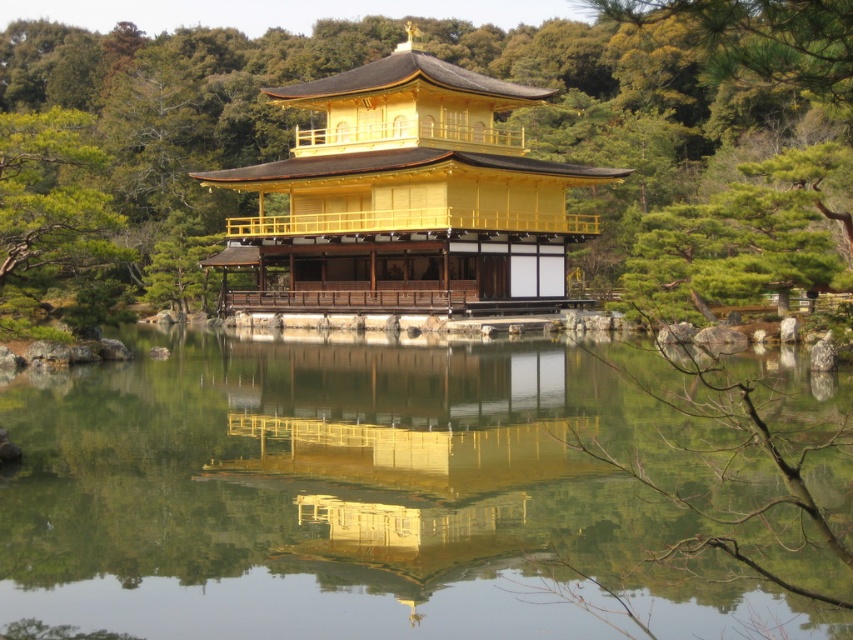
Consider the image. You are a photographer planning to capture the Golden Pavilion and its reflection in the water. You are standing at the edge of the transparent glass water at center and want to walk to the green leafy tree at center to adjust your shot. Given that your camera bag is 1.2 meters in length, will you be able to carry it comfortably while moving between these two points?

The distance between the transparent glass water at center and the green leafy tree at center is 32.39 meters. Since the camera bag is only 1.2 meters in length, the distance between the two points is much larger than the camera bag length. Therefore, you can comfortably carry the camera bag while moving between these two points.

You are a visitor at Kinkaku temple and want to take a photo that includes both the green leafy tree at center and the golden polished wood pagoda at center. Which object should you position closer to the camera to ensure both fit in the frame?

The golden polished wood pagoda at center is smaller in size than the green leafy tree at center, so positioning the golden polished wood pagoda at center closer to the camera will help both fit within the frame.

You are a visitor at Kinkaku temple and want to take a photo of the transparent glass water at center and the green leafy tree at center. Which object should you focus on first if you want to capture both in one shot without moving the camera?

The transparent glass water at center has a smaller size compared to green leafy tree at center. To capture both in one shot without moving the camera, you should focus on the larger object first, which is the green leafy tree at center, as it occupies more space in the frame.